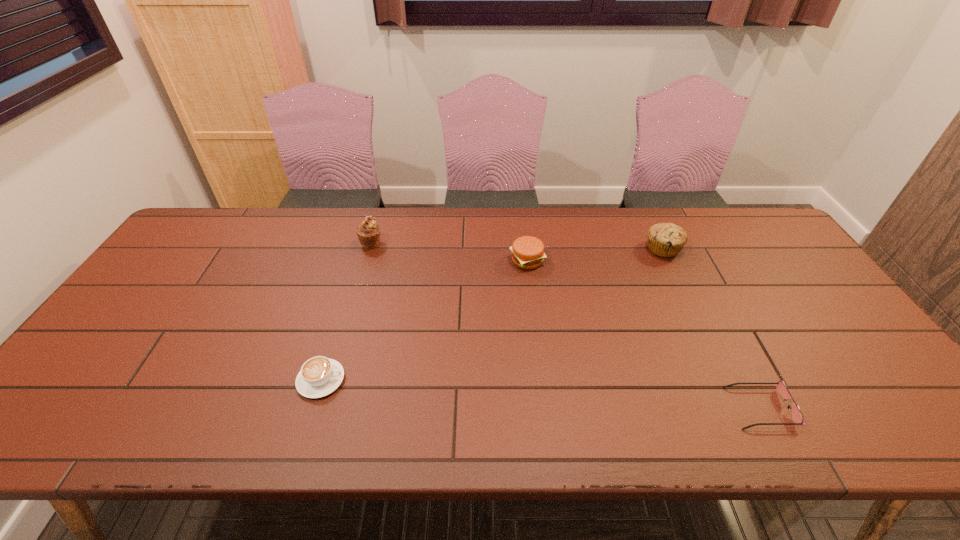
Locate an element on the screen. This screenshot has width=960, height=540. free space that is in between the sunglasses and the left muffin is located at coordinates (565, 326).

The image size is (960, 540). In order to click on free space between the shortest object and the right muffin in this screenshot , I will do `click(711, 328)`.

Where is `free spot between the cappuccino and the third tallest object`? free spot between the cappuccino and the third tallest object is located at coordinates (424, 320).

At what (x,y) coordinates should I click in order to perform the action: click on vacant area that lies between the right muffin and the third shortest object. Please return your answer as a coordinate pair (x, y). The image size is (960, 540). Looking at the image, I should click on pos(595,255).

I want to click on free space between the sunglasses and the right muffin, so click(711, 328).

At what (x,y) coordinates should I click in order to perform the action: click on vacant space that's between the left muffin and the shortest object. Please return your answer as a coordinate pair (x, y). Looking at the image, I should click on (565, 326).

Find the location of a particular element. This screenshot has height=540, width=960. vacant space that is in between the shortest object and the third object from right to left is located at coordinates (643, 334).

Locate an element on the screen. vacant space in between the cappuccino and the left muffin is located at coordinates (347, 312).

Identify the location of vacant space that is in between the third shortest object and the cappuccino. The image size is (960, 540). (424, 320).

Identify the location of object that is the third closest to the right muffin. (368, 232).